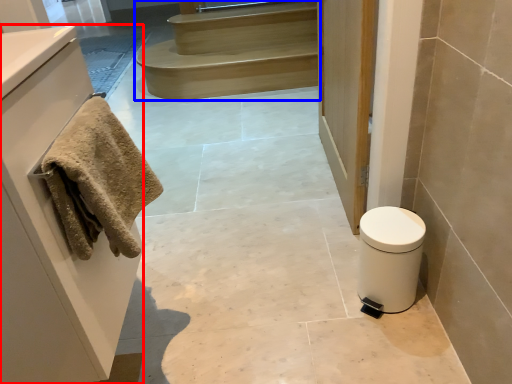
Question: Which object is closer to the camera taking this photo, cabinetry (highlighted by a red box) or stairs (highlighted by a blue box)?

Choices:
 (A) cabinetry
 (B) stairs

Answer: (A)